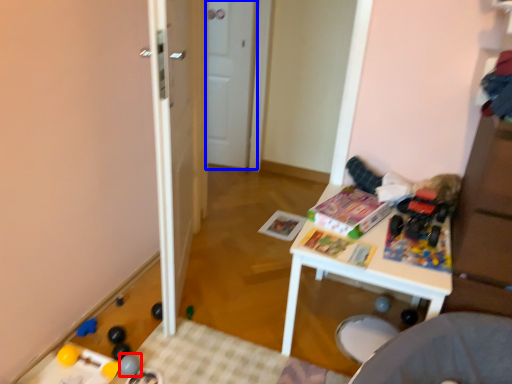
Question: Which object is closer to the camera taking this photo, toy (highlighted by a red box) or door (highlighted by a blue box)?

Choices:
 (A) toy
 (B) door

Answer: (A)